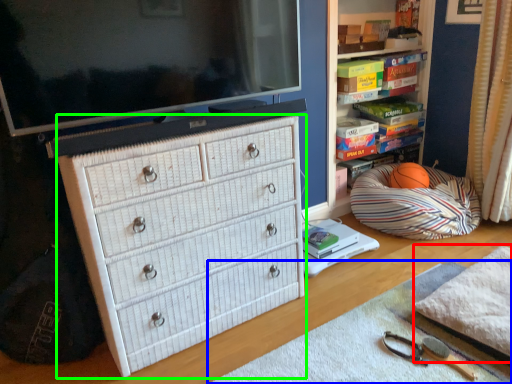
Question: Based on their relative distances, which object is nearer to blanket (highlighted by a red box)? Choose from plain (highlighted by a blue box) and chest of drawers (highlighted by a green box).

Choices:
 (A) plain
 (B) chest of drawers

Answer: (A)